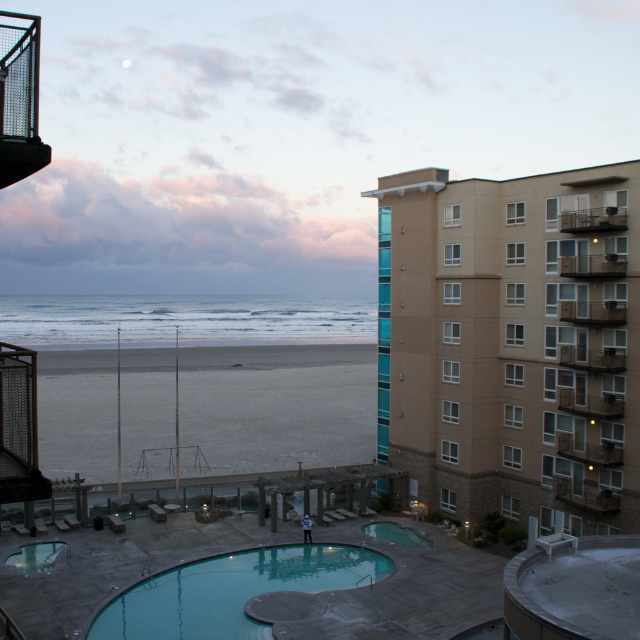
Question: Which object appears closest to the camera in this image?

Choices:
 (A) gray sand at lower left
 (B) teal glossy pool at center
 (C) beige concrete building at right

Answer: (B)

Question: Does beige concrete building at right have a smaller size compared to teal glossy pool at lower center?

Choices:
 (A) no
 (B) yes

Answer: (A)

Question: Estimate the real-world distances between objects in this image. Which object is farther from the beige concrete building at right?

Choices:
 (A) clear glass pool at lower left
 (B) teal glossy pool at center
 (C) teal glossy pool at lower center
 (D) gray sand at lower left

Answer: (D)

Question: Is gray sand at lower left to the left of teal glossy pool at center from the viewer's perspective?

Choices:
 (A) no
 (B) yes

Answer: (B)

Question: Which object appears farthest from the camera in this image?

Choices:
 (A) teal glossy pool at lower center
 (B) beige concrete building at right
 (C) gray sand at lower left
 (D) teal glossy pool at center

Answer: (C)

Question: Can you confirm if gray sand at lower left is wider than teal glossy pool at lower center?

Choices:
 (A) yes
 (B) no

Answer: (A)